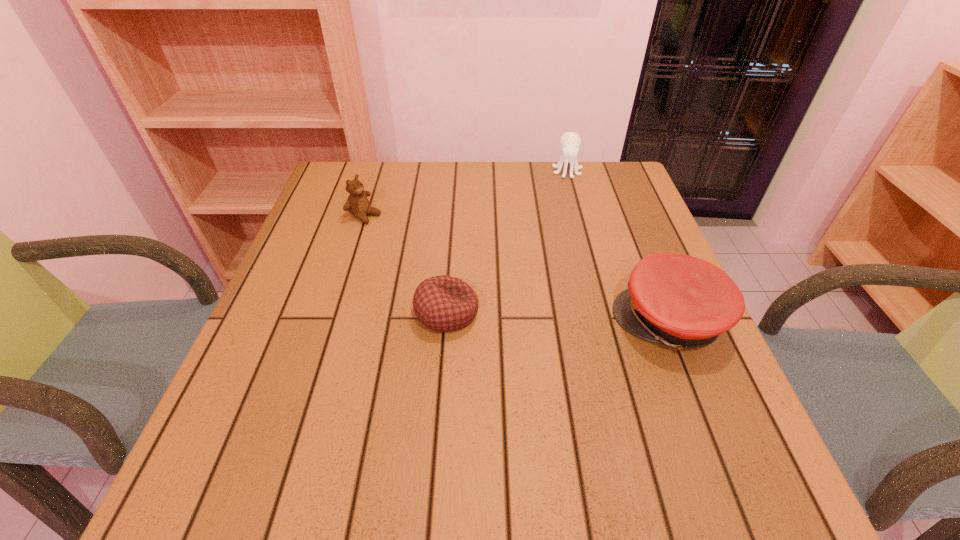
I want to click on octopus that is at the right edge, so click(570, 142).

Image resolution: width=960 pixels, height=540 pixels. Find the location of `object that is at the far left corner`. object that is at the far left corner is located at coordinates (357, 204).

You are a GUI agent. You are given a task and a screenshot of the screen. Output one action in this format:
    pyautogui.click(x=<x>, y=<y>)
    Task: Click on the object at the far right corner
    This screenshot has height=540, width=960.
    Given the screenshot: What is the action you would take?
    pyautogui.click(x=570, y=142)

Image resolution: width=960 pixels, height=540 pixels. Identify the location of free space at the far edge of the desktop. (431, 172).

Find the location of a particular element. This screenshot has width=960, height=540. free space at the near edge of the desktop is located at coordinates (480, 421).

What are the coordinates of `vacant space at the left edge of the desktop` in the screenshot? It's located at (357, 222).

Locate an element on the screen. Image resolution: width=960 pixels, height=540 pixels. vacant position at the right edge of the desktop is located at coordinates (625, 288).

Identify the location of free space at the far left corner of the desktop. (344, 188).

I want to click on free space at the far right corner of the desktop, so click(x=602, y=163).

Where is `free space between the farthest object and the cap`? free space between the farthest object and the cap is located at coordinates (618, 246).